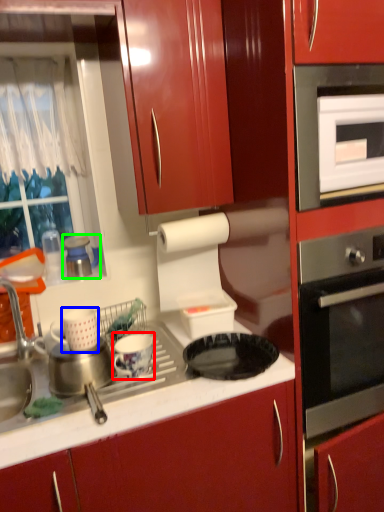
Question: Which is nearer to the appliance (highlighted by a red box)? appliance (highlighted by a blue box) or appliance (highlighted by a green box).

Choices:
 (A) appliance
 (B) appliance

Answer: (A)